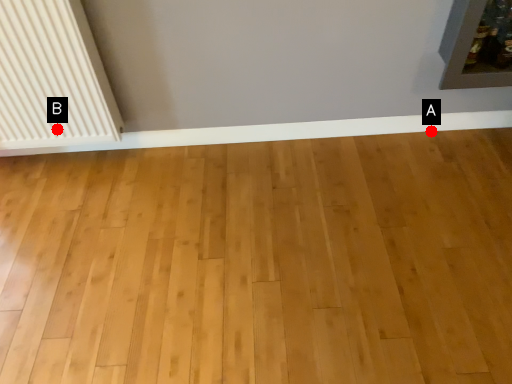
Question: Two points are circled on the image, labeled by A and B beside each circle. Which point appears closest to the camera in this image?

Choices:
 (A) A is closer
 (B) B is closer

Answer: (B)